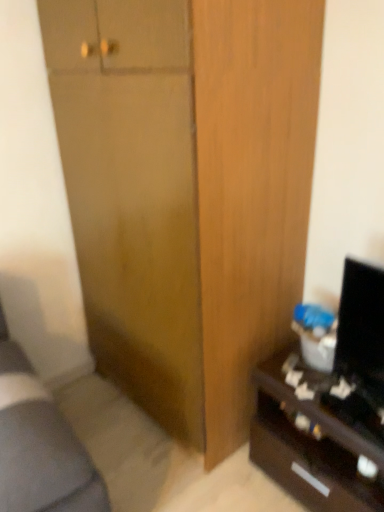
Question: Looking at the image, does wooden cabinet at center seem bigger or smaller compared to black glossy desk at lower right?

Choices:
 (A) small
 (B) big

Answer: (B)

Question: In the image, is wooden cabinet at center on the left side or the right side of black glossy desk at lower right?

Choices:
 (A) left
 (B) right

Answer: (A)

Question: From the image's perspective, relative to black glossy desk at lower right, is wooden cabinet at center above or below?

Choices:
 (A) above
 (B) below

Answer: (A)

Question: Considering the positions of black glossy desk at lower right and wooden cabinet at center in the image, is black glossy desk at lower right wider or thinner than wooden cabinet at center?

Choices:
 (A) wide
 (B) thin

Answer: (B)

Question: In the image, is black glossy desk at lower right positioned in front of or behind wooden cabinet at center?

Choices:
 (A) front
 (B) behind

Answer: (B)

Question: From the image's perspective, is black glossy desk at lower right above or below wooden cabinet at center?

Choices:
 (A) below
 (B) above

Answer: (A)

Question: In terms of size, does black glossy desk at lower right appear bigger or smaller than wooden cabinet at center?

Choices:
 (A) big
 (B) small

Answer: (B)